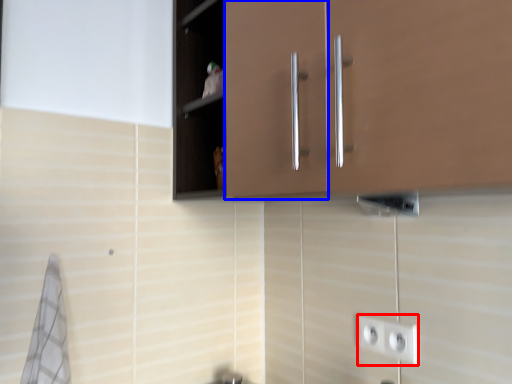
Question: Which object appears closest to the camera in this image, socket (highlighted by a red box) or cabinetry (highlighted by a blue box)?

Choices:
 (A) socket
 (B) cabinetry

Answer: (A)